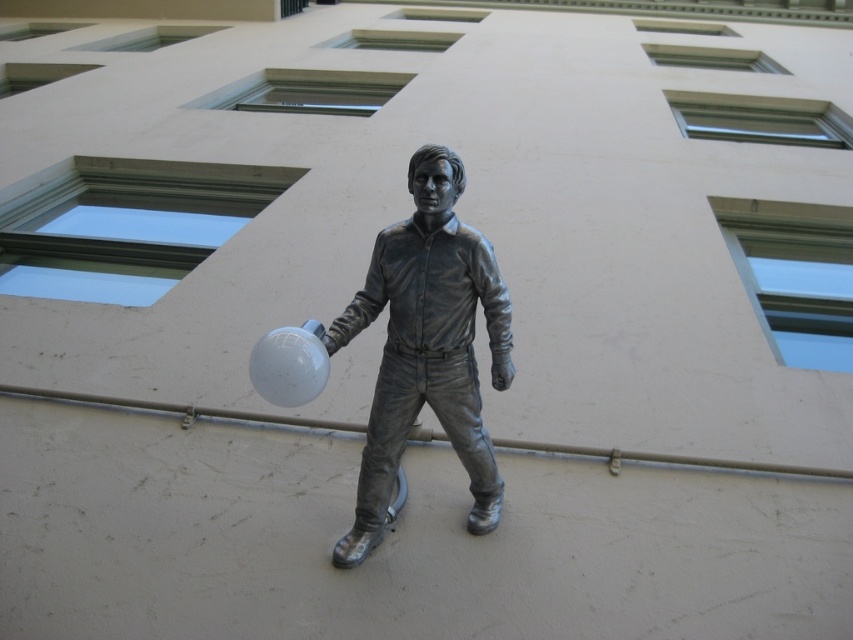
Does point (498, 381) lie in front of point (283, 358)?

No, (498, 381) is behind (283, 358).

This screenshot has height=640, width=853. Describe the element at coordinates (427, 346) in the screenshot. I see `shiny bronze figure at center` at that location.

Describe the element at coordinates (427, 346) in the screenshot. I see `shiny bronze figure at center` at that location.

Identify the location of shiny bronze figure at center. Image resolution: width=853 pixels, height=640 pixels. (427, 346).